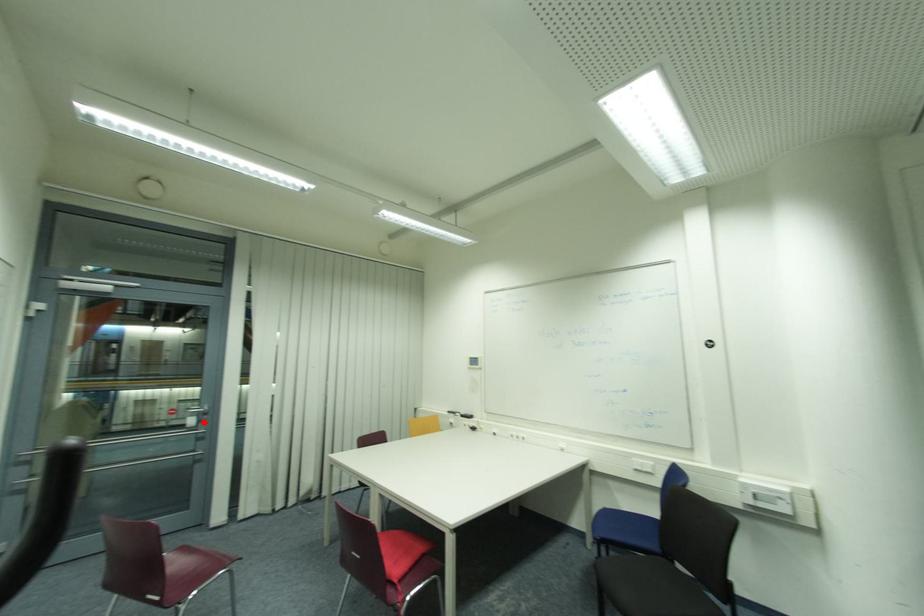
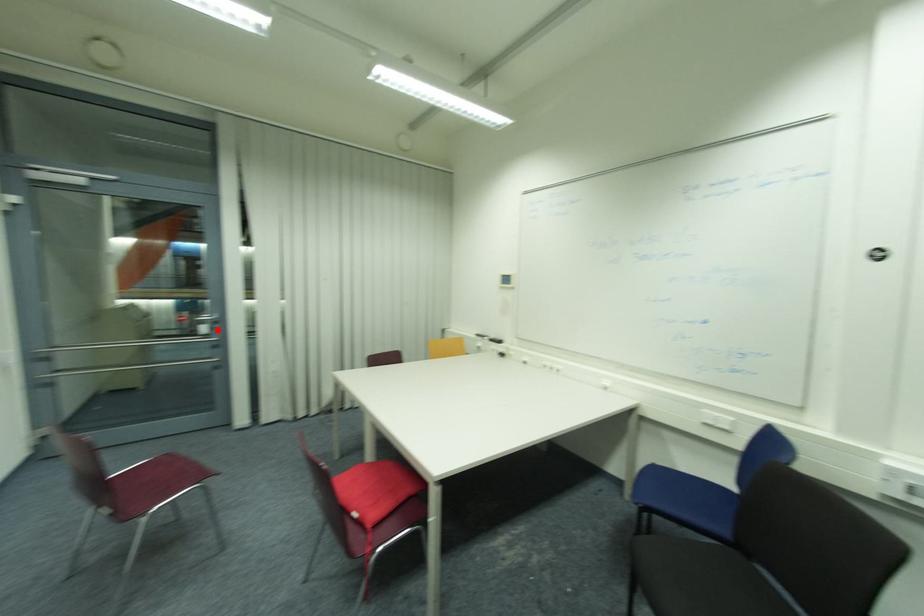
I am providing you with two images of the same scene from different viewpoints. A red point is marked on the first image and another point is marked on the second image. Are the points marked in image1 and image2 representing the same 3D position?

Yes